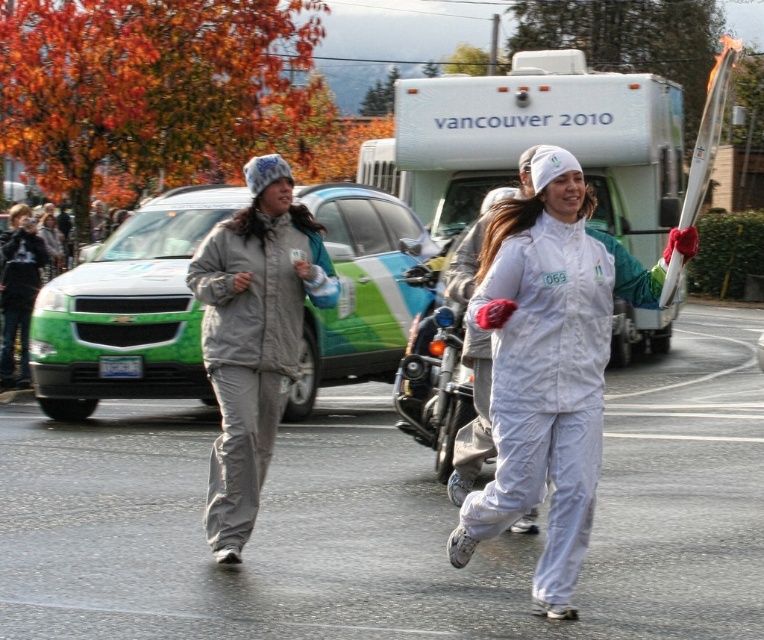
Question: Which point appears closest to the camera in this image?

Choices:
 (A) (497, 332)
 (B) (272, 266)
 (C) (460, 349)

Answer: (A)

Question: Which point is closer to the camera taking this photo?

Choices:
 (A) (557, 573)
 (B) (416, 355)
 (C) (251, 294)

Answer: (A)

Question: Which object is closer to the camera taking this photo?

Choices:
 (A) gray fleece jacket at left
 (B) white matte suit at center
 (C) shiny chrome motorcycle at center

Answer: (B)

Question: Can you confirm if gray fleece jacket at left is positioned above shiny chrome motorcycle at center?

Choices:
 (A) no
 (B) yes

Answer: (B)

Question: Does white matte suit at center have a greater width compared to shiny chrome motorcycle at center?

Choices:
 (A) no
 (B) yes

Answer: (B)

Question: Does white matte suit at center come behind gray fleece jacket at left?

Choices:
 (A) no
 (B) yes

Answer: (A)